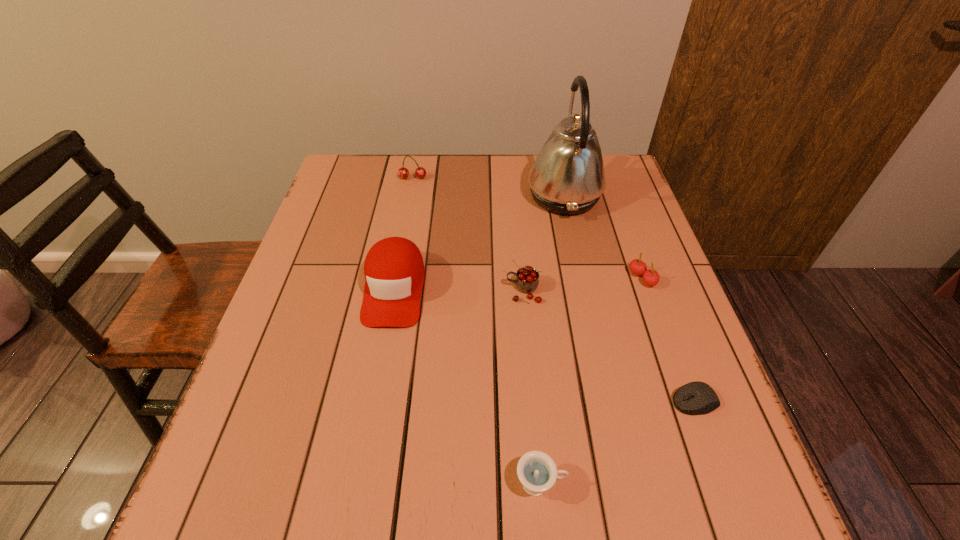
This screenshot has width=960, height=540. In the image, there is a desktop. What are the coordinates of `free space at the far right corner` in the screenshot? It's located at (618, 163).

The image size is (960, 540). Find the location of `unoccupied position between the teacup and the second cherry from left to right`. unoccupied position between the teacup and the second cherry from left to right is located at coordinates (532, 387).

Identify the location of free space that is in between the shortest cherry and the teacup. The image size is (960, 540). (591, 381).

At what (x,y) coordinates should I click in order to perform the action: click on vacant point located between the farthest cherry and the second cherry from right to left. Please return your answer as a coordinate pair (x, y). The height and width of the screenshot is (540, 960). Looking at the image, I should click on (468, 234).

Where is `vacant point located between the sixth farthest object and the second cherry from right to left`? vacant point located between the sixth farthest object and the second cherry from right to left is located at coordinates (610, 346).

Image resolution: width=960 pixels, height=540 pixels. Find the location of `vacant area that lies between the tallest object and the baseball cap`. vacant area that lies between the tallest object and the baseball cap is located at coordinates (479, 242).

The image size is (960, 540). I want to click on vacant point located between the second tallest object and the sixth farthest object, so click(x=544, y=345).

This screenshot has width=960, height=540. Identify the location of unoccupied position between the shortest object and the baseball cap. (544, 345).

You are a GUI agent. You are given a task and a screenshot of the screen. Output one action in this format:
    pyautogui.click(x=<x>, y=<y>)
    Task: Click on the free space that is in between the tallest object and the shortest cherry
    
    Given the screenshot: What is the action you would take?
    pyautogui.click(x=603, y=237)

In order to click on object identified as the third closest to the kettle in this screenshot , I will do `click(394, 272)`.